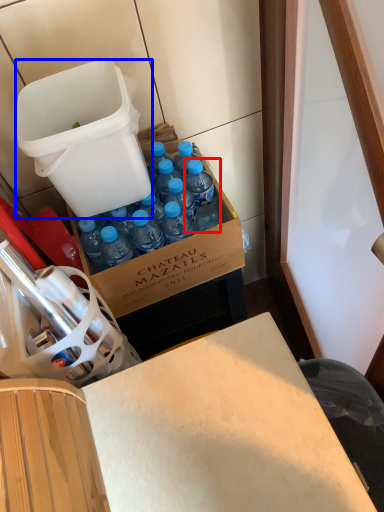
Question: Which point is closer to the camera, bottle (highlighted by a red box) or trash bin/can (highlighted by a blue box)?

Choices:
 (A) bottle
 (B) trash bin/can

Answer: (B)